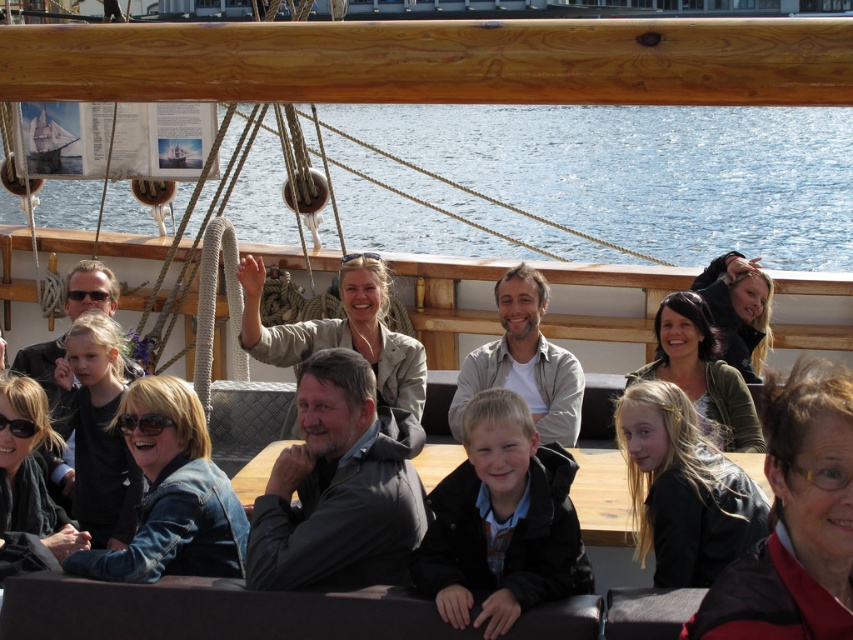
Between blue water at upper center and light brown hair at center, which one appears on the left side from the viewer's perspective?

Positioned to the left is blue water at upper center.

What do you see at coordinates (646, 172) in the screenshot?
I see `blue water at upper center` at bounding box center [646, 172].

Is point (578, 211) more distant than point (496, 522)?

Yes.

Locate an element on the screen. blue water at upper center is located at coordinates (646, 172).

Does blue water at upper center lie behind dark gray jacket at center?

Yes, blue water at upper center is behind dark gray jacket at center.

This screenshot has width=853, height=640. Find the location of `blue water at upper center`. blue water at upper center is located at coordinates (646, 172).

Where is `blue water at upper center`? The width and height of the screenshot is (853, 640). blue water at upper center is located at coordinates (646, 172).

Does light brown hair at center appear on the left side of light brown wood at center?

Indeed, light brown hair at center is positioned on the left side of light brown wood at center.

Is point (477, 538) closer to viewer compared to point (511, 268)?

Yes, point (477, 538) is closer to viewer.

This screenshot has height=640, width=853. What are the coordinates of `light brown hair at center` in the screenshot? It's located at (502, 522).